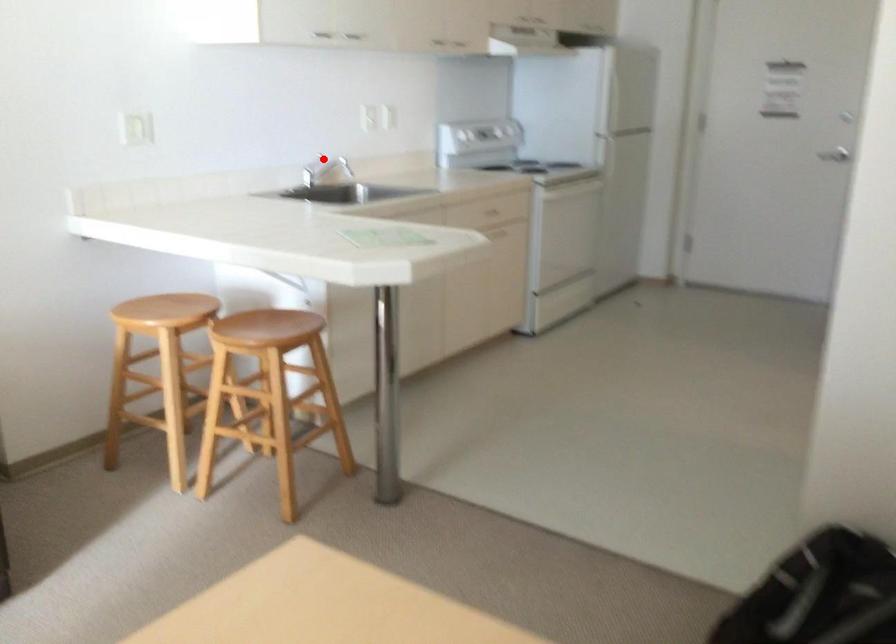
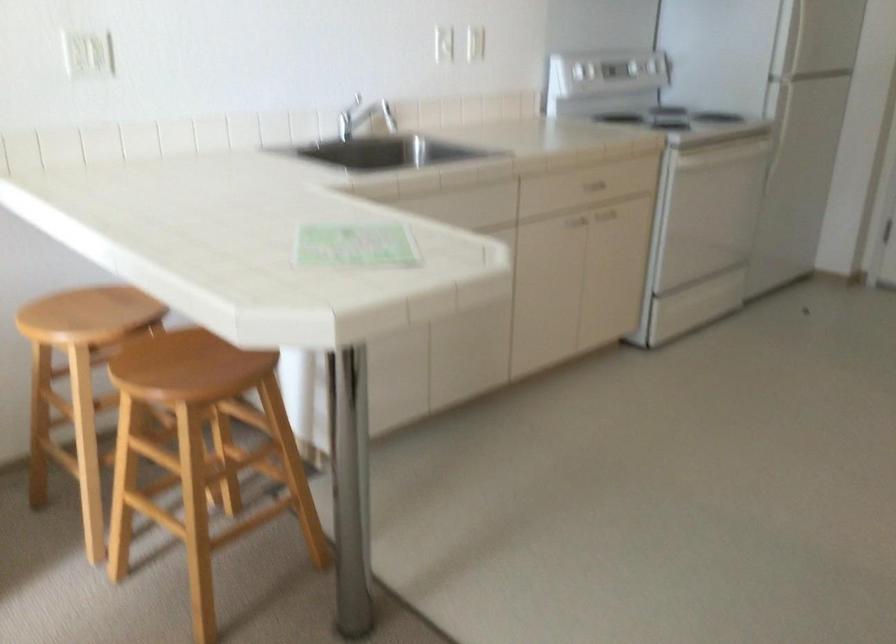
The point at the highlighted location is marked in the first image. Where is the corresponding point in the second image?

(375, 111)